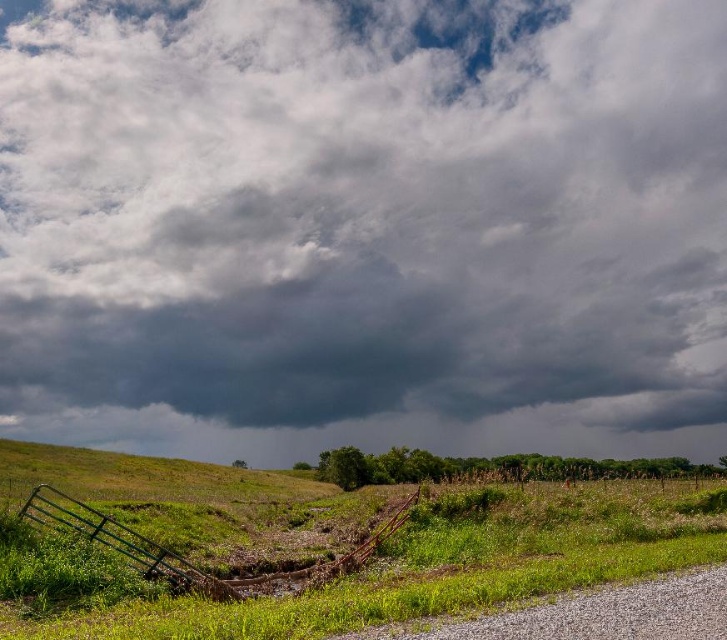
Does dark gray cloud at upper center have a lesser width compared to green grassy field at lower left?

Incorrect, dark gray cloud at upper center's width is not less than green grassy field at lower left's.

Does dark gray cloud at upper center have a lesser height compared to green grassy field at lower left?

In fact, dark gray cloud at upper center may be taller than green grassy field at lower left.

The width and height of the screenshot is (727, 640). What do you see at coordinates (364, 227) in the screenshot?
I see `dark gray cloud at upper center` at bounding box center [364, 227].

At what (x,y) coordinates should I click in order to perform the action: click on dark gray cloud at upper center. Please return your answer as a coordinate pair (x, y). Looking at the image, I should click on (364, 227).